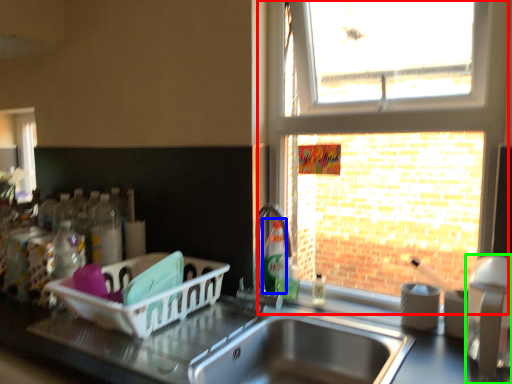
Question: Considering the real-world distances, which object is closest to window (highlighted by a red box)? bottle (highlighted by a blue box) or appliance (highlighted by a green box).

Choices:
 (A) bottle
 (B) appliance

Answer: (A)